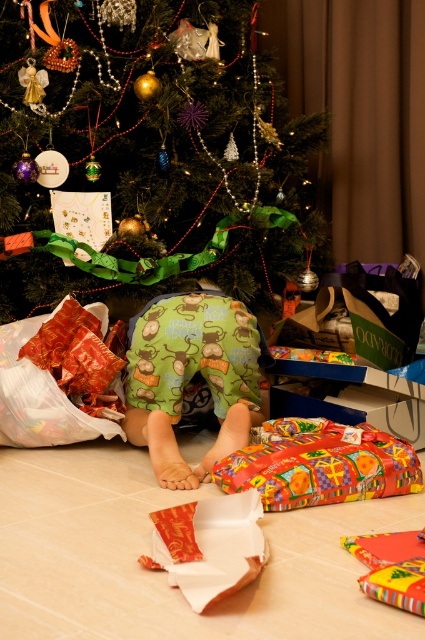
Question: Which of the following is the farthest from the observer?

Choices:
 (A) green fabric pants at center
 (B) shiny gold paper at lower center
 (C) shiny metallic ornaments at upper center

Answer: (C)

Question: Can you confirm if green fabric pants at center is positioned to the left of shiny gold paper at lower center?

Choices:
 (A) no
 (B) yes

Answer: (B)

Question: Estimate the real-world distances between objects in this image. Which object is farther from the shiny metallic ornaments at upper center?

Choices:
 (A) multicolored glossy paper at lower center
 (B) shiny gold paper at lower center

Answer: (B)

Question: Does green fabric pants at center have a larger size compared to shiny gold paper at lower center?

Choices:
 (A) no
 (B) yes

Answer: (B)

Question: Which object appears farthest from the camera in this image?

Choices:
 (A) shiny metallic ornaments at upper center
 (B) shiny gold paper at lower center
 (C) multicolored glossy paper at lower center

Answer: (A)

Question: Can you confirm if green fabric pants at center is positioned to the right of shiny gold paper at lower center?

Choices:
 (A) yes
 (B) no

Answer: (B)